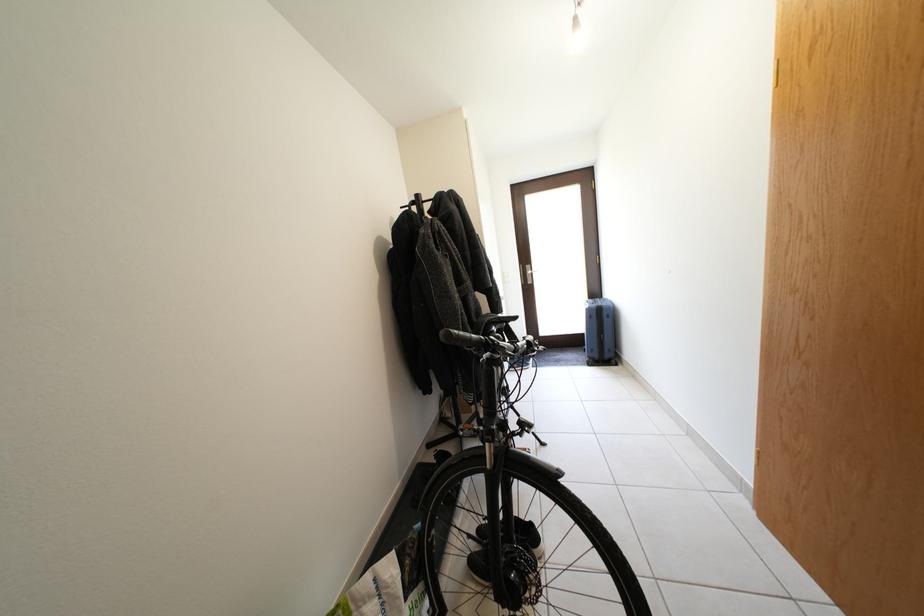
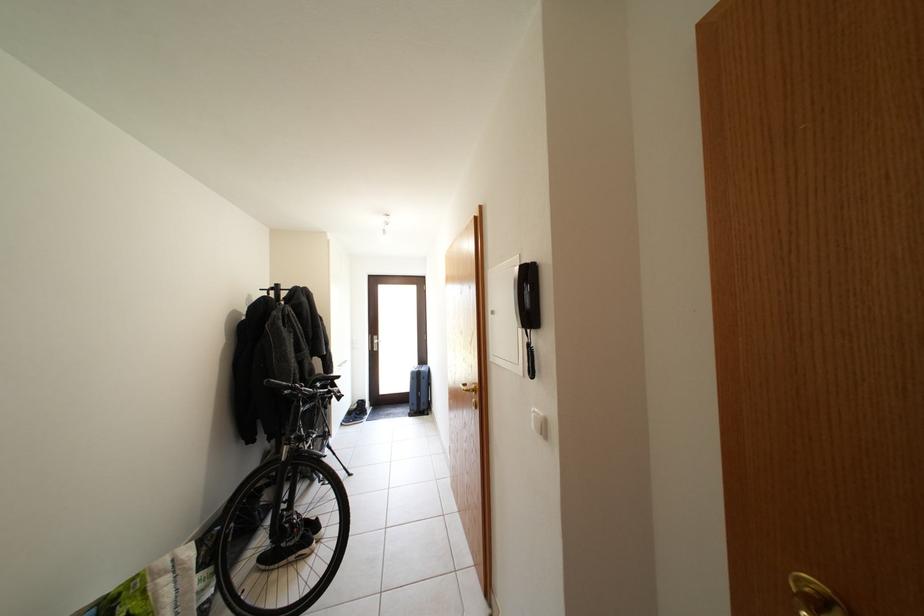
Locate, in the second image, the point that corresponds to pixel 479 345 in the first image.

(289, 390)